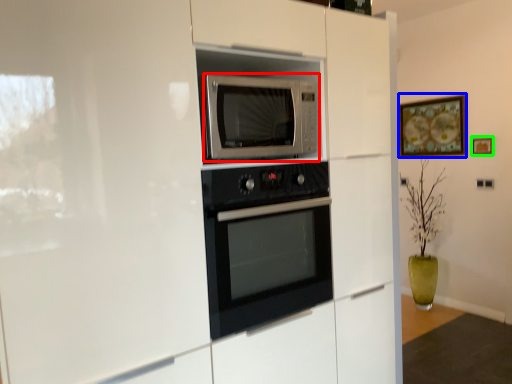
Question: Considering the real-world distances, which object is closest to microwave oven (highlighted by a red box)? picture frame (highlighted by a blue box) or picture frame (highlighted by a green box).

Choices:
 (A) picture frame
 (B) picture frame

Answer: (B)